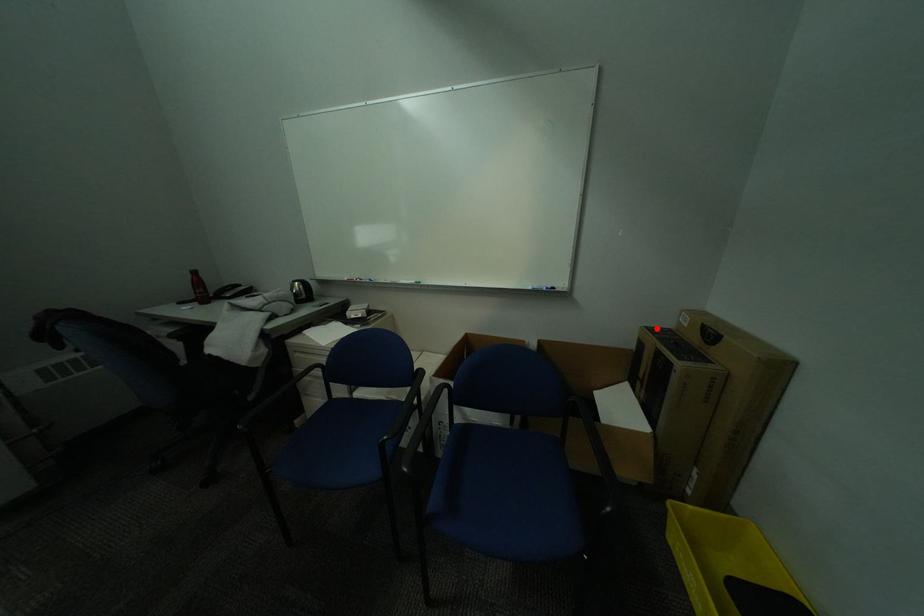
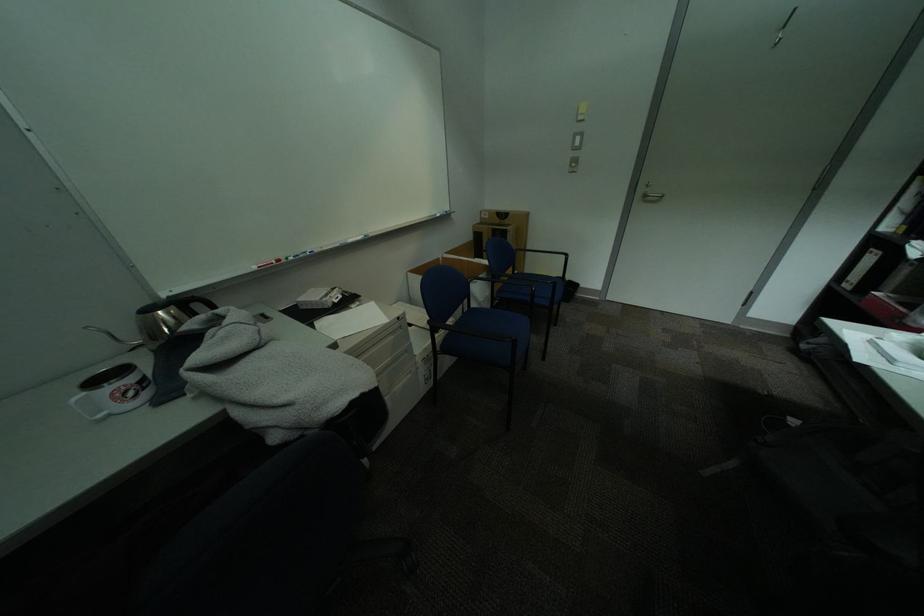
Where in the second image is the point corresponding to the highlighted location from the first image?

(487, 225)